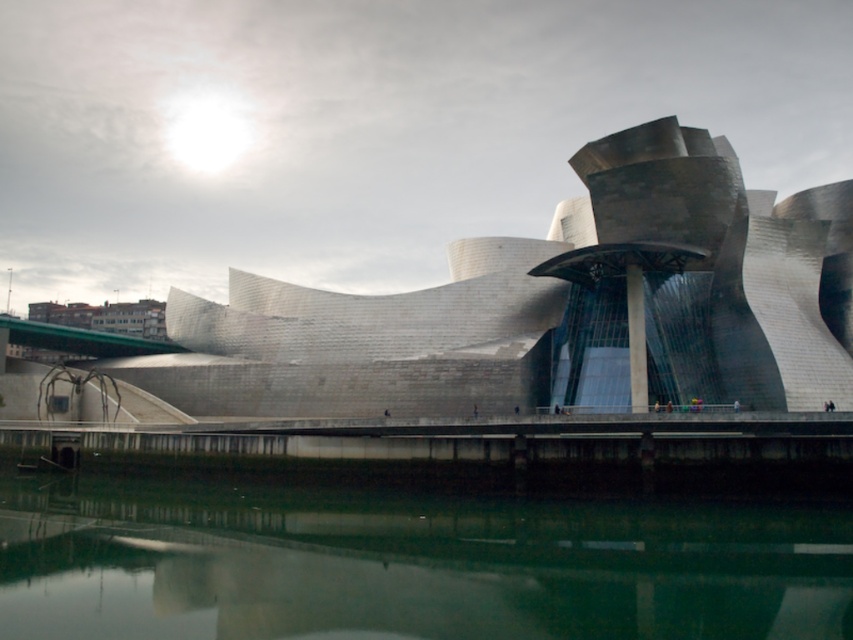
You are an architect visiting the Guggenheim Museum Bilbao. You notice the polished steel building at center and the green reflective water at lower center. Based on their positions, which one would you say is closer to the front of the scene?

The polished steel building at center is closer to the front of the scene because the green reflective water at lower center is positioned behind it.

You are standing at point 0.5, 0.65. You want to walk to the polished steel building at center. Which direction should you go?

Since you are at point (554,320) and the polished steel building at center is at point (554,307), you are already very close to it. The coordinates are nearly the same, so you can proceed straight ahead.

You are an architect visiting the Guggenheim Museum Bilbao. You notice the polished steel building at center and the green reflective water at lower center. Which object is located above the other?

The polished steel building at center is positioned over green reflective water at lower center, so it is located above the green reflective water at lower center.